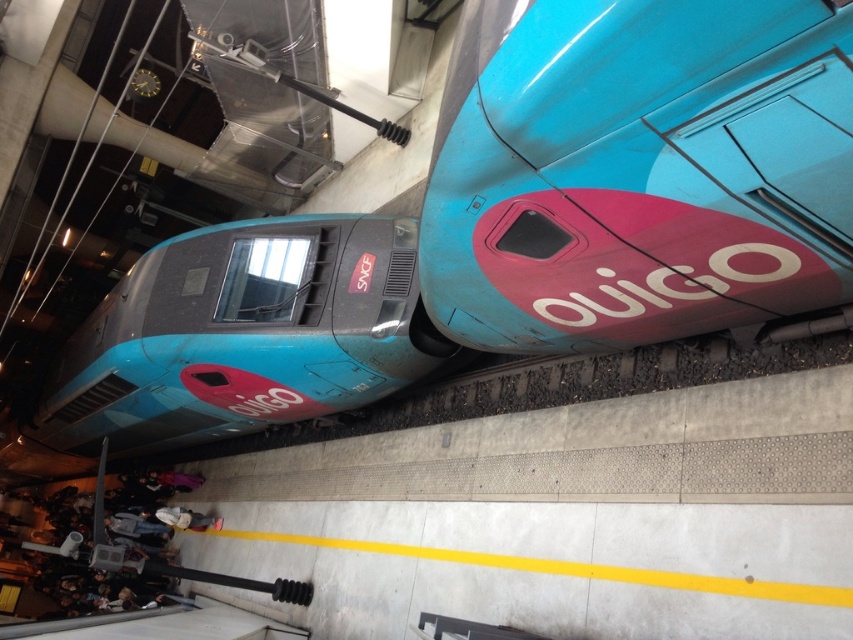
You are a maintenance worker who needs to inspect both the shiny blue train at upper right and the matte blue train at center. The safety regulations require that you must stay at least 10 feet away from any train to avoid interference. Can you safely stand between them while working on one of the trains?

The shiny blue train at upper right is 9.09 feet from the matte blue train at center. Since the required safety distance is 10 feet, standing between them would place you within the 9.09 feet gap, which is less than the required 10 feet. Therefore, it is not safe to stand between them while working on either train.

You are a passenger waiting at the train station. You see two trains, the shiny blue train at upper right and the matte blue train at center. Which one is positioned to the right side of the other?

The shiny blue train at upper right is positioned to the right of the matte blue train at center.

You are a platform attendant checking the alignment of the trains. The shiny blue train at upper right and the matte blue train at center are both approaching the platform. Based on their positions, which train is more likely to overhang the yellow safety line if they stop at the same position?

The shiny blue train at upper right is more likely to overhang the yellow safety line because it might be wider than the matte blue train at center.